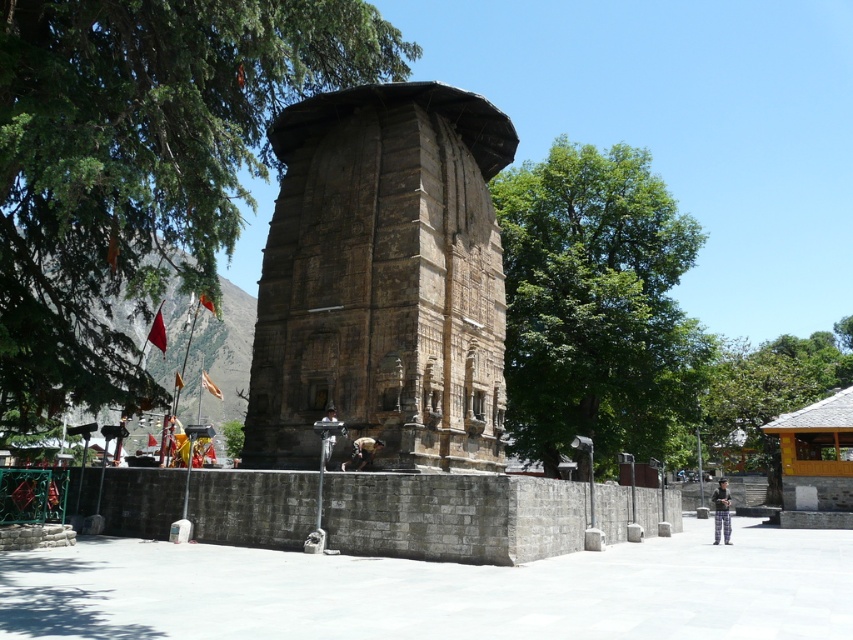
Between point (637, 275) and point (724, 481), which one is positioned in front?

Point (637, 275) is in front.

The width and height of the screenshot is (853, 640). What do you see at coordinates (596, 305) in the screenshot?
I see `green leafy tree at center` at bounding box center [596, 305].

Does point (662, 250) come in front of point (724, 531)?

No, it is not.

Locate an element on the screen. green leafy tree at center is located at coordinates (596, 305).

Between brown stone monument at center and green leafy tree at right, which one has less height?

With less height is brown stone monument at center.

The width and height of the screenshot is (853, 640). What are the coordinates of `brown stone monument at center` in the screenshot? It's located at (383, 280).

Looking at this image, between brown stone monument at center and plaid pants at lower right, which one has less height?

plaid pants at lower right

Can you confirm if brown stone monument at center is bigger than plaid pants at lower right?

Incorrect, brown stone monument at center is not larger than plaid pants at lower right.

This screenshot has height=640, width=853. Identify the location of brown stone monument at center. (383, 280).